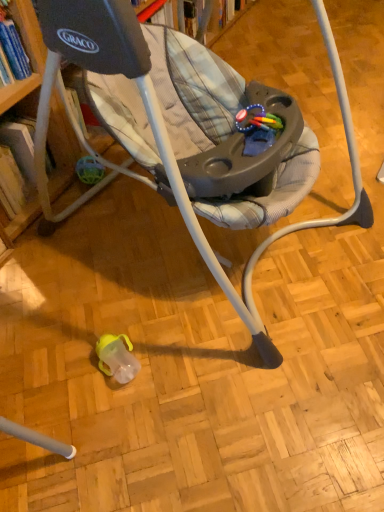
Locate an element on the screen. The image size is (384, 512). vacant area that is in front of matte gray baby swing at center is located at coordinates (204, 406).